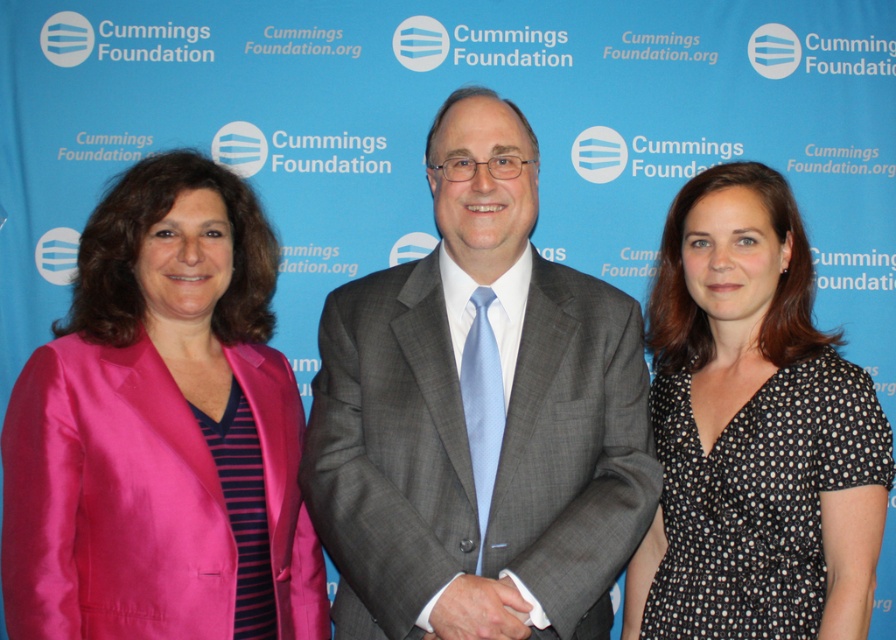
You are attending a virtual meeting and need to identify the speaker based on their clothing. The speaker is wearing the gray suit at center. Which clothing item is positioned higher on the screen compared to the black dotted dress at center?

The gray suit at center is located above the black dotted dress at center, so the gray suit at center is positioned higher on the screen.

You are attending a Cummings Foundation event and need to decide which clothing item to wear. You want to choose the larger one between the gray suit at center and the satin pink blazer at left. Which one should you pick?

The gray suit at center is bigger than the satin pink blazer at left, so you should pick the gray suit at center.